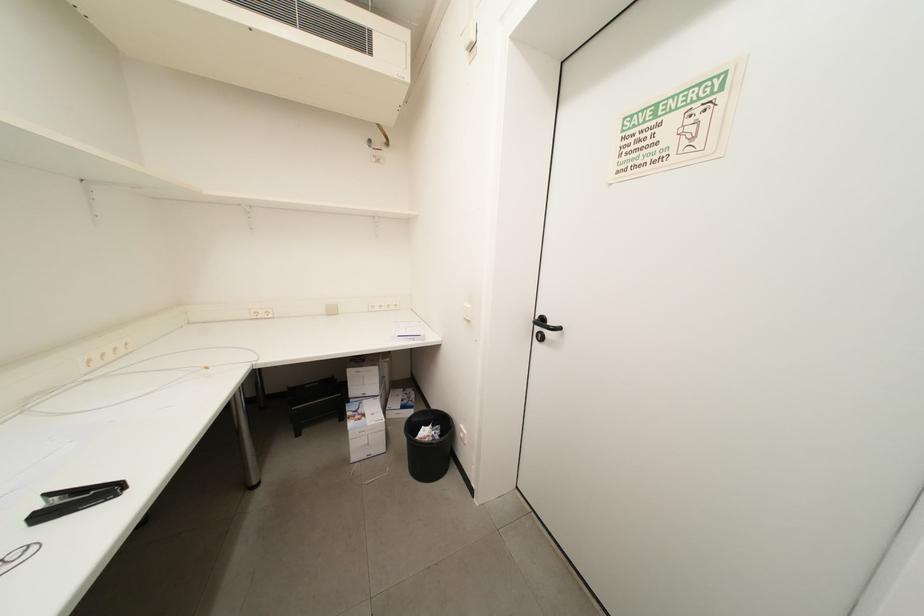
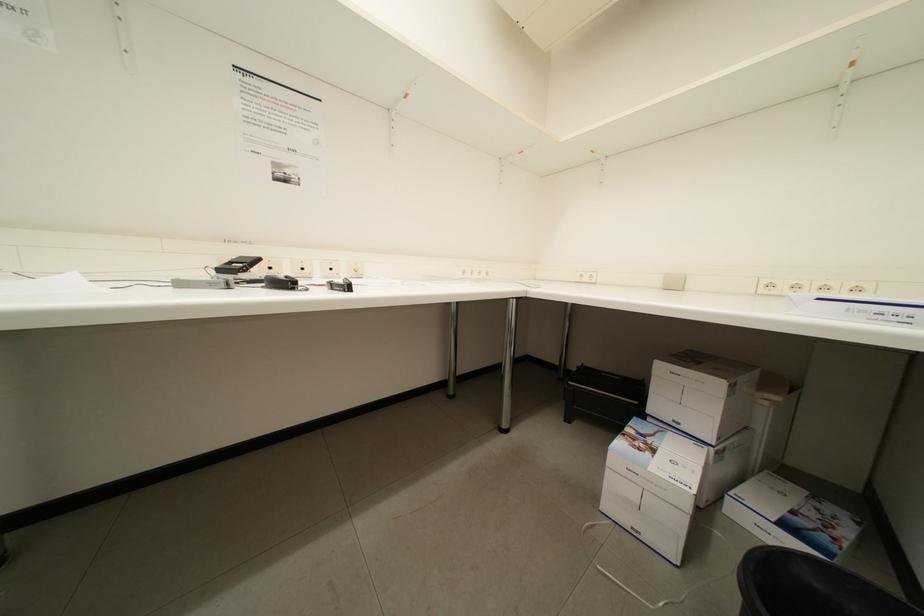
Question: The camera is either moving clockwise (left) or counter-clockwise (right) around the object. The first image is from the beginning of the video and the second image is from the end. Is the camera moving left or right when shooting the video?

Choices:
 (A) Left
 (B) Right

Answer: (B)